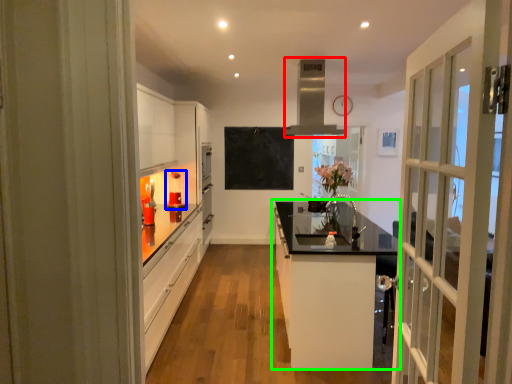
Question: Which object is positioned farthest from exhaust hood (highlighted by a red box)? Select from appliance (highlighted by a blue box) and cabinetry (highlighted by a green box).

Choices:
 (A) appliance
 (B) cabinetry

Answer: (A)